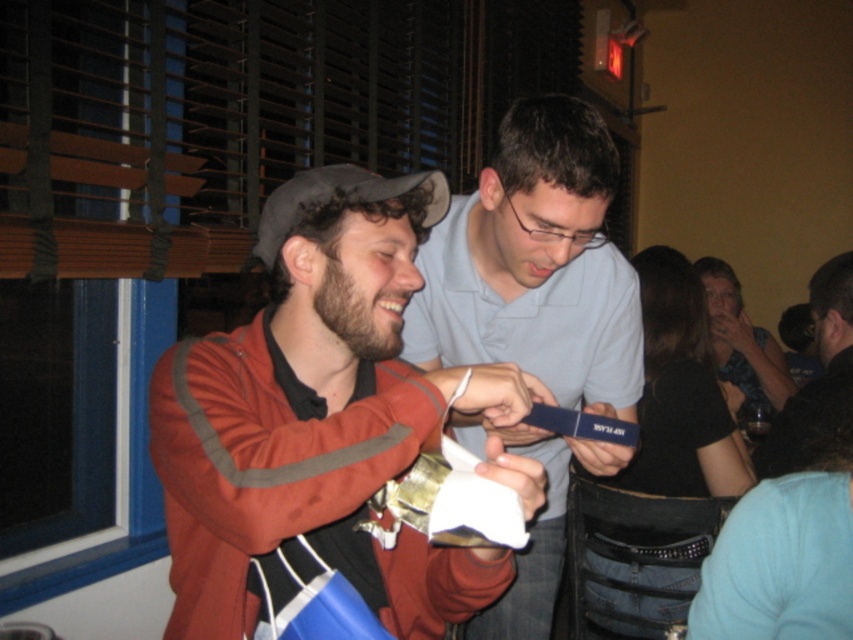
In order to click on dark blue shirt at center in this screenshot , I will do `click(817, 376)`.

Can you confirm if dark blue shirt at center is thinner than matte black phone at right?

Yes.

Who is more distant from viewer, (831, 298) or (758, 348)?

The point (758, 348) is more distant.

Find the location of a particular element. dark blue shirt at center is located at coordinates (817, 376).

Measure the distance between matte blue shirt at center and camera.

matte blue shirt at center and camera are 34.88 inches apart.

I want to click on matte blue shirt at center, so click(535, 266).

Is matte brown cap at upper left to the left of matte blue shirt at center from the viewer's perspective?

Yes, matte brown cap at upper left is to the left of matte blue shirt at center.

The image size is (853, 640). I want to click on matte brown cap at upper left, so click(318, 420).

The width and height of the screenshot is (853, 640). Find the location of `matte brown cap at upper left`. matte brown cap at upper left is located at coordinates (318, 420).